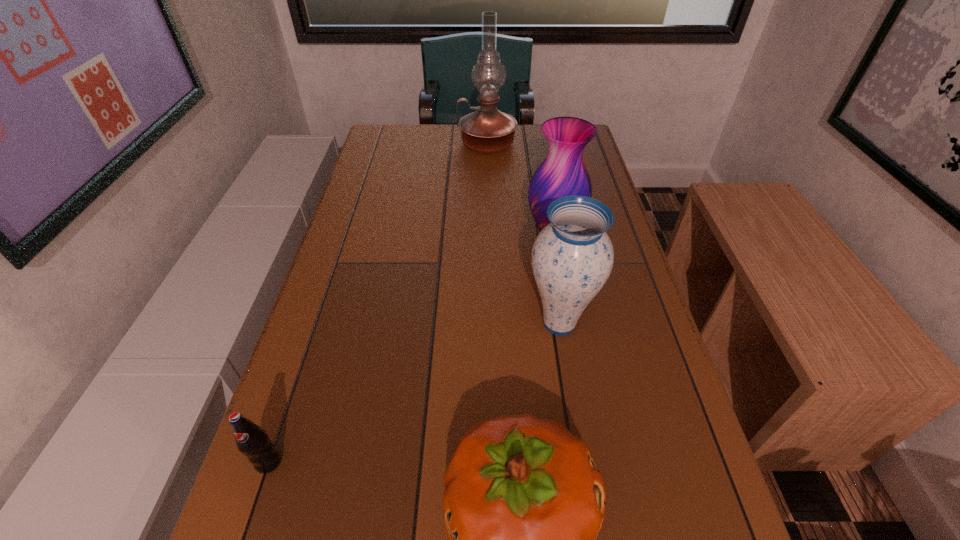
This screenshot has height=540, width=960. I want to click on vacant area that lies between the oil lamp and the third farthest object, so [523, 233].

Locate which object is the third closest to the nearer vase. Please provide its 2D coordinates. Your answer should be formatted as a tuple, i.e. [(x, y)], where the tuple contains the x and y coordinates of a point satisfying the conditions above.

[(252, 441)]

The image size is (960, 540). What are the coordinates of `the third closest object to the farther vase` in the screenshot? It's located at (524, 501).